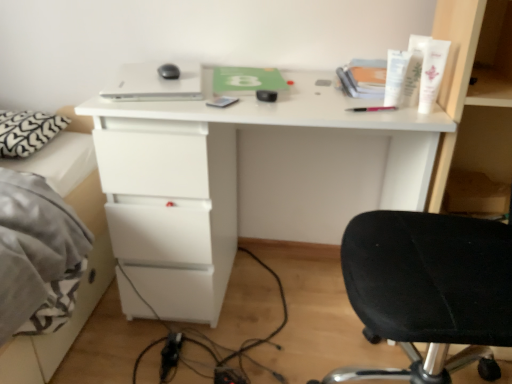
I want to click on free space to the left of white plastic tube at upper right, which is the 2th toiletry in right-to-left order, so click(x=353, y=105).